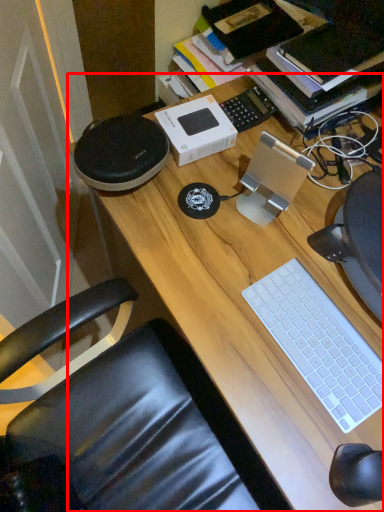
Question: Observing the image, what is the correct spatial positioning of desk (annotated by the red box) in reference to computer keyboard?

Choices:
 (A) left
 (B) right

Answer: (B)